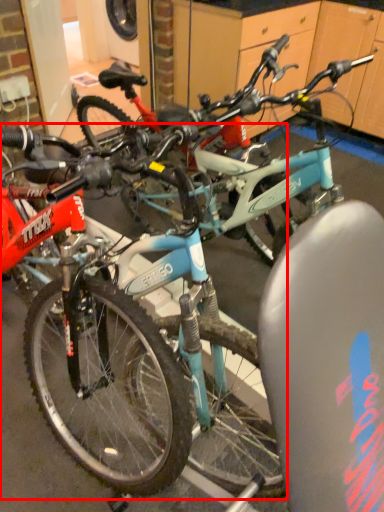
Question: From the image's perspective, what is the correct spatial positioning of bicycle (annotated by the red box) in reference to bicycle?

Choices:
 (A) above
 (B) below

Answer: (B)